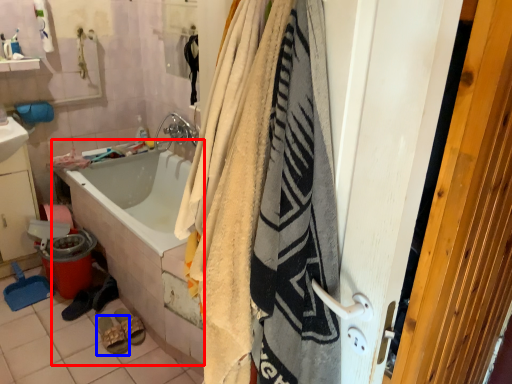
Question: Which of the following is the farthest to the observer, bath (highlighted by a red box) or footwear (highlighted by a blue box)?

Choices:
 (A) bath
 (B) footwear

Answer: (B)